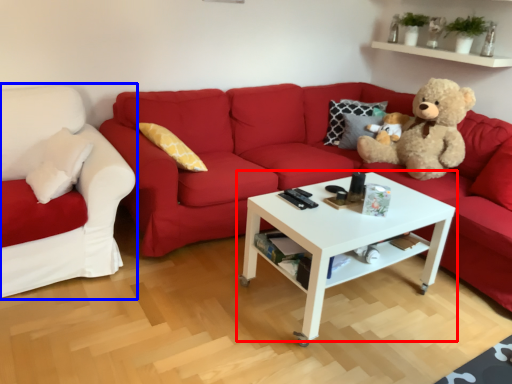
Question: Which point is closer to the camera, coffee table (highlighted by a red box) or studio couch (highlighted by a blue box)?

Choices:
 (A) coffee table
 (B) studio couch

Answer: (A)